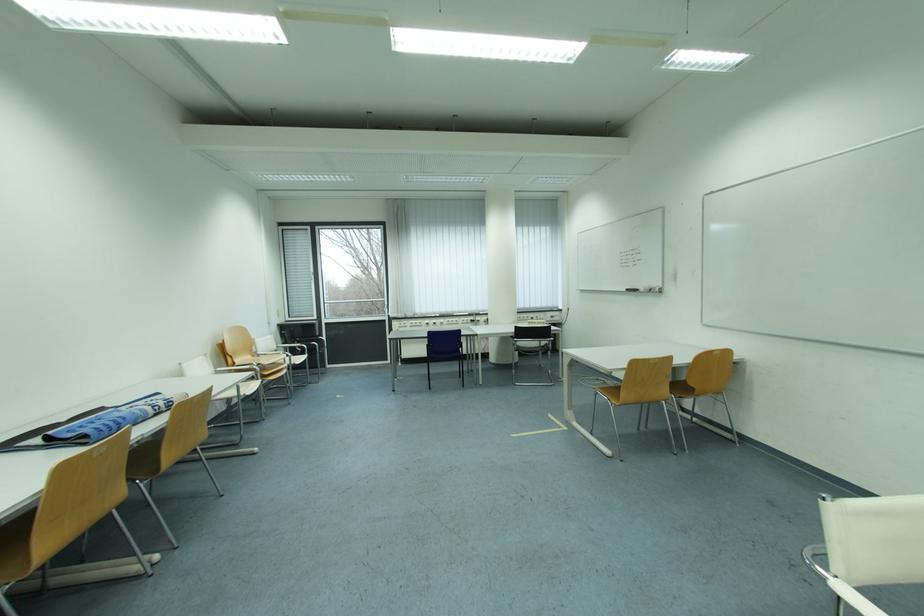
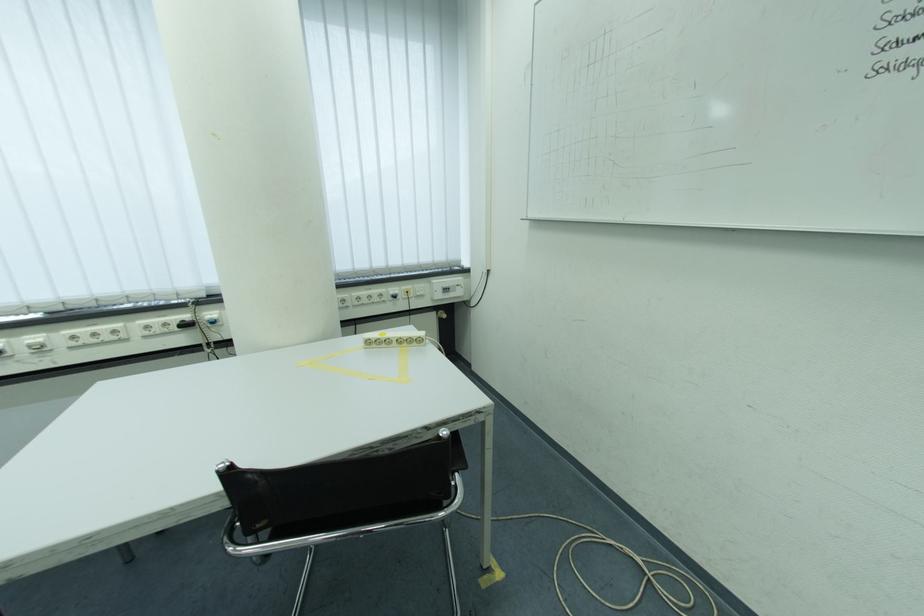
In the second image, find the point that corresponds to (x=529, y=320) in the first image.

(368, 301)